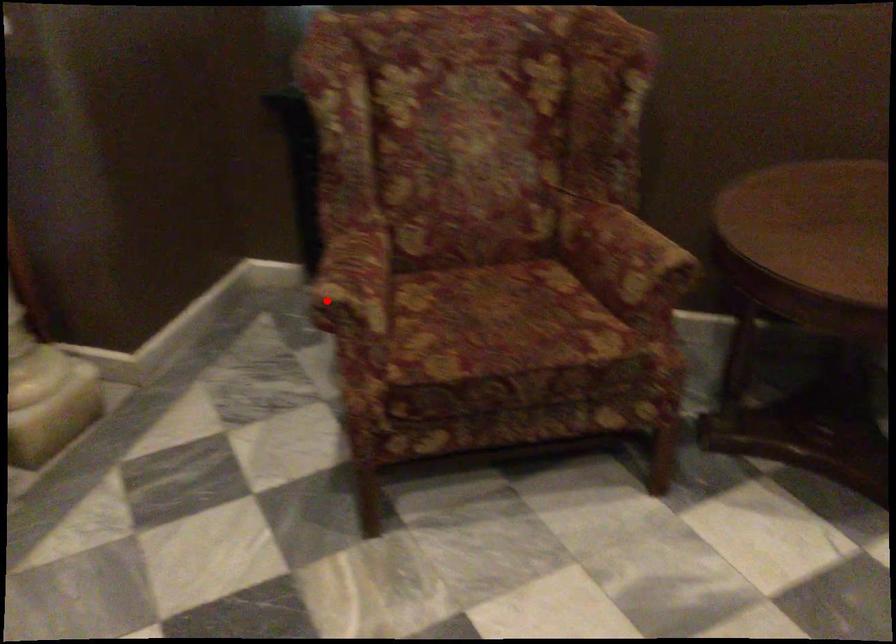
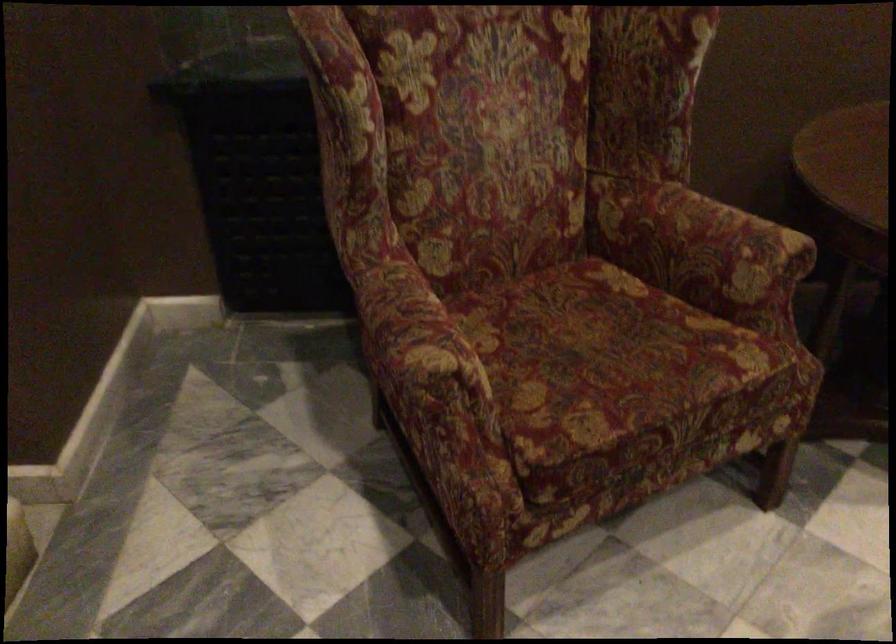
Question: I am providing you with two images of the same scene from different viewpoints. In image1, a red point is highlighted. Considering the same 3D point in image2, which of the following is correct?

Choices:
 (A) It is closer
 (B) It is farther

Answer: (A)